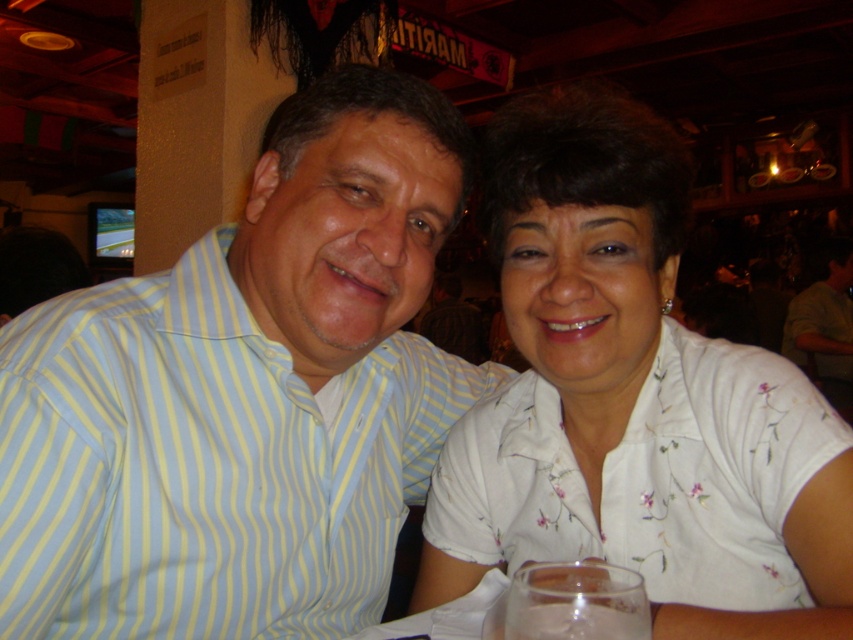
Question: Is light blue striped shirt at center to the left of white floral shirt at center from the viewer's perspective?

Choices:
 (A) yes
 (B) no

Answer: (A)

Question: From the image, what is the correct spatial relationship of light blue striped shirt at center in relation to white floral shirt at center?

Choices:
 (A) left
 (B) right

Answer: (A)

Question: Does light blue striped shirt at center appear on the left side of white floral shirt at center?

Choices:
 (A) yes
 (B) no

Answer: (A)

Question: Which object appears farthest from the camera in this image?

Choices:
 (A) light blue striped shirt at center
 (B) white floral shirt at center

Answer: (B)